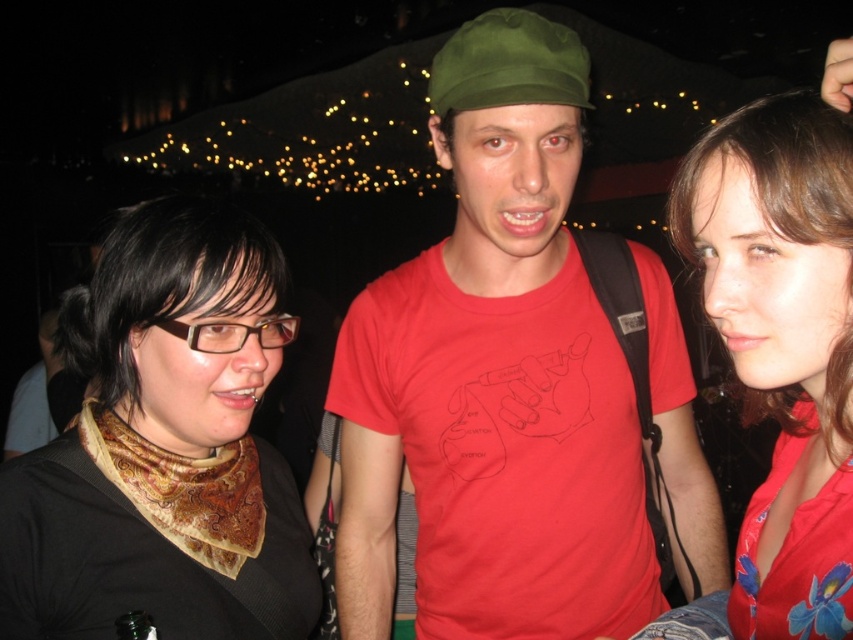
Can you confirm if matte red t-shirt at center is thinner than black satin scarf at left?

No.

Locate an element on the screen. matte red t-shirt at center is located at coordinates (495, 378).

The height and width of the screenshot is (640, 853). Describe the element at coordinates (495, 378) in the screenshot. I see `matte red t-shirt at center` at that location.

I want to click on matte red t-shirt at center, so tap(495, 378).

Is point (42, 500) farther from viewer compared to point (668, 209)?

No, it is in front of (668, 209).

You are a GUI agent. You are given a task and a screenshot of the screen. Output one action in this format:
    pyautogui.click(x=<x>, y=<y>)
    Task: Click on the black satin scarf at left
    
    Given the screenshot: What is the action you would take?
    pyautogui.click(x=165, y=448)

The height and width of the screenshot is (640, 853). I want to click on black satin scarf at left, so click(165, 448).

Which of these two, matte red t-shirt at center or matte red blouse at center, stands shorter?

matte red blouse at center is shorter.

This screenshot has width=853, height=640. Describe the element at coordinates (495, 378) in the screenshot. I see `matte red t-shirt at center` at that location.

Find the location of a particular element. matte red t-shirt at center is located at coordinates (495, 378).